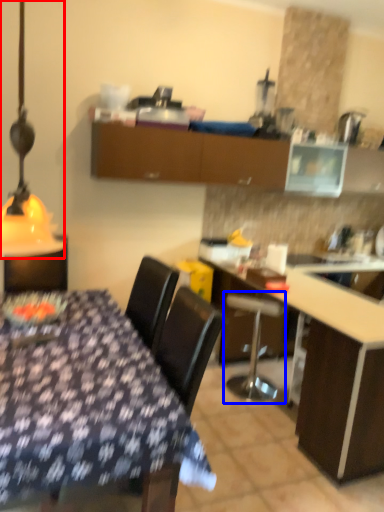
Question: Which point is closer to the camera, table lamp (highlighted by a red box) or bar stool (highlighted by a blue box)?

Choices:
 (A) table lamp
 (B) bar stool

Answer: (A)